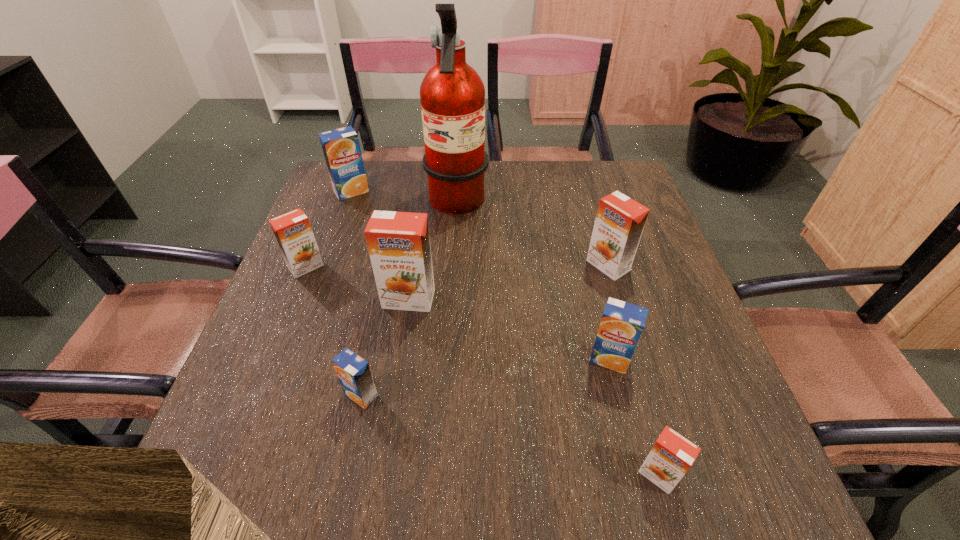
Where is `orange juice that is the fifth nearest to the nearest blue orange_juice`? This screenshot has width=960, height=540. orange juice that is the fifth nearest to the nearest blue orange_juice is located at coordinates [x=620, y=220].

Find the location of a particular element. orange orange juice that is the second closest to the tallest orange juice is located at coordinates (620, 220).

Find the location of `orange orange juice that is the closest one to the third smallest orange orange juice`. orange orange juice that is the closest one to the third smallest orange orange juice is located at coordinates (398, 243).

In order to click on blue orange_juice that is the second closest to the fire extinguisher in this screenshot , I will do `click(622, 323)`.

Identify which blue orange_juice is the second nearest to the second smallest blue orange_juice. Please provide its 2D coordinates. Your answer should be formatted as a tuple, i.e. [(x, y)], where the tuple contains the x and y coordinates of a point satisfying the conditions above.

[(341, 148)]

Where is `vacant area in the image that satisfies the following two spatial constraints: 1. on the nozzle and handle of the second biggest orange orange juice; 2. on the left side of the tallest object`? The image size is (960, 540). vacant area in the image that satisfies the following two spatial constraints: 1. on the nozzle and handle of the second biggest orange orange juice; 2. on the left side of the tallest object is located at coordinates (453, 266).

Image resolution: width=960 pixels, height=540 pixels. I want to click on vacant area in the image that satisfies the following two spatial constraints: 1. on the back side of the nearest orange juice; 2. on the nozzle and handle of the tallest object, so click(x=583, y=206).